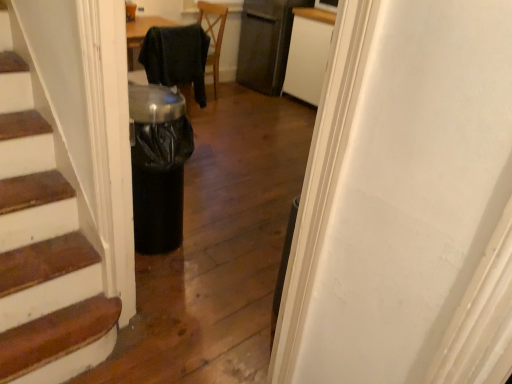
At what (x,y) coordinates should I click in order to perform the action: click on black fabric chair at center. Please return your answer as a coordinate pair (x, y). Image resolution: width=512 pixels, height=384 pixels. Looking at the image, I should click on (176, 57).

Measure the distance between satin black refrigerator at upper center and camera.

The depth of satin black refrigerator at upper center is 14.21 feet.

Where is `black fabric chair at center`? black fabric chair at center is located at coordinates (176, 57).

Considering the sizes of objects black fabric chair at center and satin black refrigerator at upper center in the image provided, who is thinner, black fabric chair at center or satin black refrigerator at upper center?

Thinner between the two is black fabric chair at center.

Who is more distant, black fabric chair at center or satin black refrigerator at upper center?

satin black refrigerator at upper center is further from the camera.

Image resolution: width=512 pixels, height=384 pixels. What are the coordinates of `chair located below the satin black refrigerator at upper center (from the image's perspective)` in the screenshot? It's located at (176, 57).

Is white matte cabinet at upper center smaller than satin black refrigerator at upper center?

Actually, white matte cabinet at upper center might be larger than satin black refrigerator at upper center.

Which point is more forward, (318, 48) or (283, 28)?

The point (318, 48) is in front.

From a real-world perspective, is white matte cabinet at upper center physically above satin black refrigerator at upper center?

No, from a real-world perspective, white matte cabinet at upper center is not on top of satin black refrigerator at upper center.

Is white matte cabinet at upper center taller or shorter than black fabric chair at center?

Considering their sizes, white matte cabinet at upper center has more height than black fabric chair at center.

From a real-world perspective, is white matte cabinet at upper center located higher than black fabric chair at center?

No, from a real-world perspective, white matte cabinet at upper center is not over black fabric chair at center

Where is `chair below the white matte cabinet at upper center (from the image's perspective)`? The height and width of the screenshot is (384, 512). chair below the white matte cabinet at upper center (from the image's perspective) is located at coordinates (176, 57).

Which is farther, (259, 72) or (295, 94)?

The point (259, 72) is farther.

Is satin black refrigerator at upper center positioned far away from white matte cabinet at upper center?

No, satin black refrigerator at upper center is in close proximity to white matte cabinet at upper center.

Is satin black refrigerator at upper center facing away from white matte cabinet at upper center?

No, satin black refrigerator at upper center's orientation is not away from white matte cabinet at upper center.

Between satin black refrigerator at upper center and white matte cabinet at upper center, which one has smaller size?

Smaller between the two is satin black refrigerator at upper center.

Can you confirm if satin black refrigerator at upper center is wider than black fabric chair at center?

Yes.

Is the depth of satin black refrigerator at upper center greater than that of black fabric chair at center?

Yes, the depth of satin black refrigerator at upper center is greater than that of black fabric chair at center.

From their relative heights in the image, would you say satin black refrigerator at upper center is taller or shorter than black fabric chair at center?

Clearly, satin black refrigerator at upper center is taller compared to black fabric chair at center.

From the image's perspective, would you say satin black refrigerator at upper center is positioned over black fabric chair at center?

Yes, from the image's perspective, satin black refrigerator at upper center is over black fabric chair at center.

From the image's perspective, which one is positioned higher, black fabric chair at center or white matte cabinet at upper center?

white matte cabinet at upper center is shown above in the image.

Which object is thinner, black fabric chair at center or white matte cabinet at upper center?

black fabric chair at center.

From the picture: Is black fabric chair at center turned away from white matte cabinet at upper center?

No, black fabric chair at center's orientation is not away from white matte cabinet at upper center.

Is black fabric chair at center surrounding white matte cabinet at upper center?

Actually, white matte cabinet at upper center is outside black fabric chair at center.

Locate an element on the screen. This screenshot has height=384, width=512. appliance below the black fabric chair at center (from a real-world perspective) is located at coordinates (264, 45).

This screenshot has width=512, height=384. I want to click on appliance lying behind the white matte cabinet at upper center, so click(264, 45).

Considering their positions, is black fabric chair at center positioned closer to satin black refrigerator at upper center than white matte cabinet at upper center?

white matte cabinet at upper center is positioned closer to the anchor satin black refrigerator at upper center.

Estimate the real-world distances between objects in this image. Which object is closer to satin black refrigerator at upper center, white matte cabinet at upper center or black fabric chair at center?

Among the two, white matte cabinet at upper center is located nearer to satin black refrigerator at upper center.

Which object lies further to the anchor point white matte cabinet at upper center, satin black refrigerator at upper center or black fabric chair at center?

black fabric chair at center is further to white matte cabinet at upper center.

When comparing their distances from black fabric chair at center, does white matte cabinet at upper center or satin black refrigerator at upper center seem further?

Based on the image, satin black refrigerator at upper center appears to be further to black fabric chair at center.

Estimate the real-world distances between objects in this image. Which object is further from white matte cabinet at upper center, black fabric chair at center or satin black refrigerator at upper center?

Among the two, black fabric chair at center is located further to white matte cabinet at upper center.

When comparing their distances from black fabric chair at center, does satin black refrigerator at upper center or white matte cabinet at upper center seem closer?

white matte cabinet at upper center is closer to black fabric chair at center.

At what (x,y) coordinates should I click in order to perform the action: click on cabinetry between black fabric chair at center and satin black refrigerator at upper center in the front-back direction. Please return your answer as a coordinate pair (x, y). Looking at the image, I should click on (308, 53).